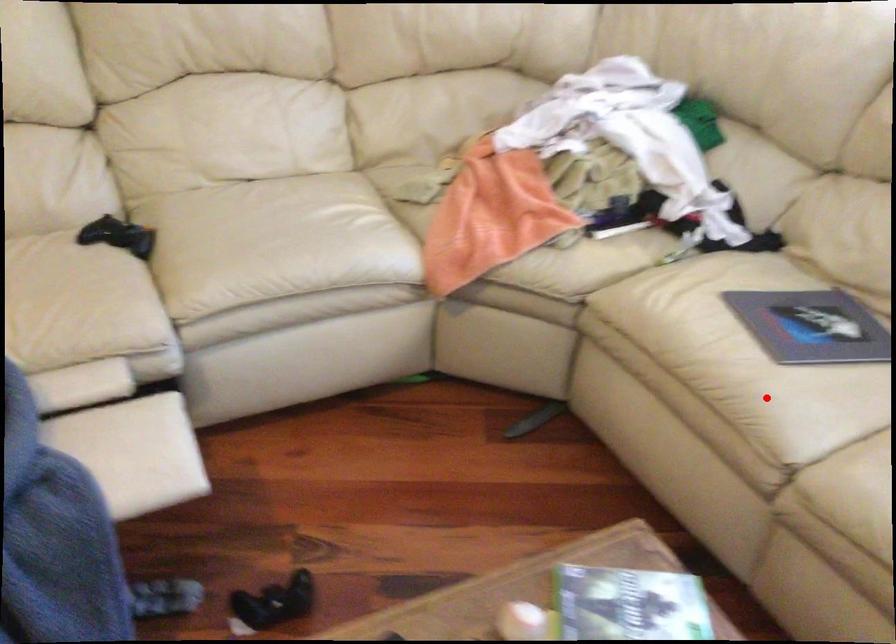
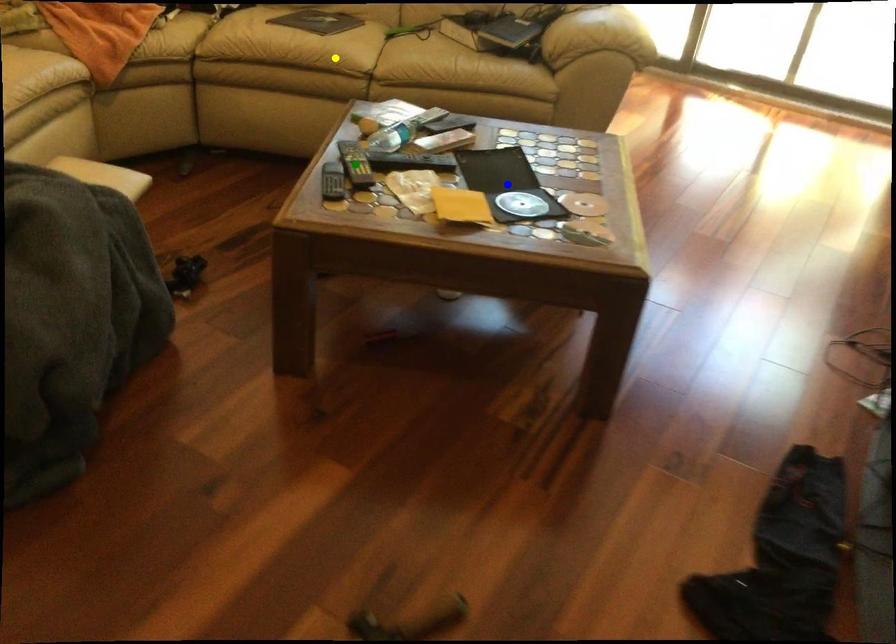
Question: I am providing you with two images of the same scene from different viewpoints. A red point is marked on the first image. You are given multiple points on the second image. In image 2, which mark is for the same physical point as the one in image 1?

Choices:
 (A) green point
 (B) yellow point
 (C) blue point

Answer: (B)